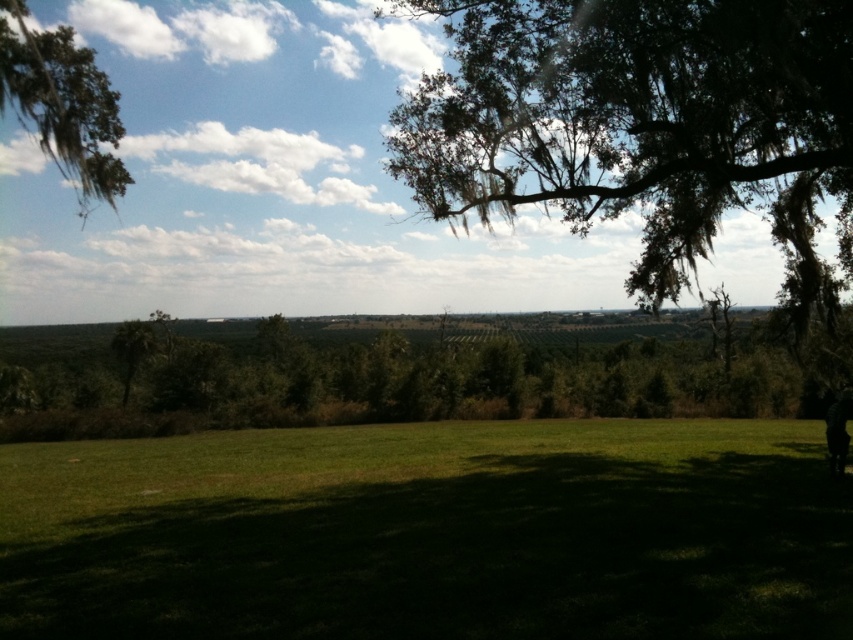
Image resolution: width=853 pixels, height=640 pixels. Identify the location of green grass at lower center. (430, 532).

Is green grass at lower center to the left of green mossy tree at upper right from the viewer's perspective?

Incorrect, green grass at lower center is not on the left side of green mossy tree at upper right.

In order to click on green grass at lower center in this screenshot , I will do `click(430, 532)`.

Locate an element on the screen. green grass at lower center is located at coordinates (430, 532).

In the scene shown: Does green leafy tree at center appear under dark green fabric at lower right?

Yes, green leafy tree at center is below dark green fabric at lower right.

Is point (117, 348) closer to viewer compared to point (851, 404)?

That is False.

Does point (135, 369) come closer to viewer compared to point (827, 420)?

No, (135, 369) is behind (827, 420).

I want to click on green leafy tree at center, so click(x=132, y=349).

Is point (137, 513) behind point (149, 346)?

No, it is in front of (149, 346).

Is green grass at lower center shorter than green leafy tree at center?

Yes, green grass at lower center is shorter than green leafy tree at center.

What do you see at coordinates (430, 532) in the screenshot? I see `green grass at lower center` at bounding box center [430, 532].

This screenshot has height=640, width=853. Identify the location of green grass at lower center. (430, 532).